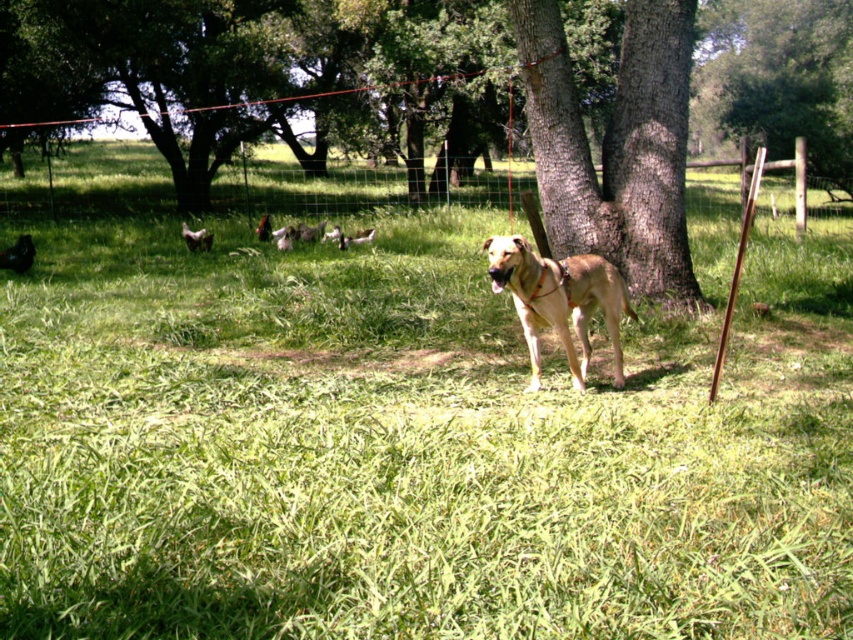
Is the position of brown rough bark tree at center more distant than that of light brown fur at center?

Yes.

How much distance is there between brown rough bark tree at center and light brown fur at center?

brown rough bark tree at center is 2.17 meters from light brown fur at center.

Is point (618, 236) closer to viewer compared to point (521, 259)?

No, (618, 236) is behind (521, 259).

This screenshot has width=853, height=640. Find the location of `brown rough bark tree at center`. brown rough bark tree at center is located at coordinates (614, 145).

Who is positioned more to the right, wire mesh fence at center or light brown fur at center?

light brown fur at center

Is wire mesh fence at center to the left of light brown fur at center from the viewer's perspective?

Correct, you'll find wire mesh fence at center to the left of light brown fur at center.

Identify the location of wire mesh fence at center. pos(90,182).

Can you confirm if brown rough bark tree at center is positioned to the left of wire mesh fence at center?

No, brown rough bark tree at center is not to the left of wire mesh fence at center.

The width and height of the screenshot is (853, 640). Describe the element at coordinates (614, 145) in the screenshot. I see `brown rough bark tree at center` at that location.

At what (x,y) coordinates should I click in order to perform the action: click on brown rough bark tree at center. Please return your answer as a coordinate pair (x, y). The image size is (853, 640). Looking at the image, I should click on (614, 145).